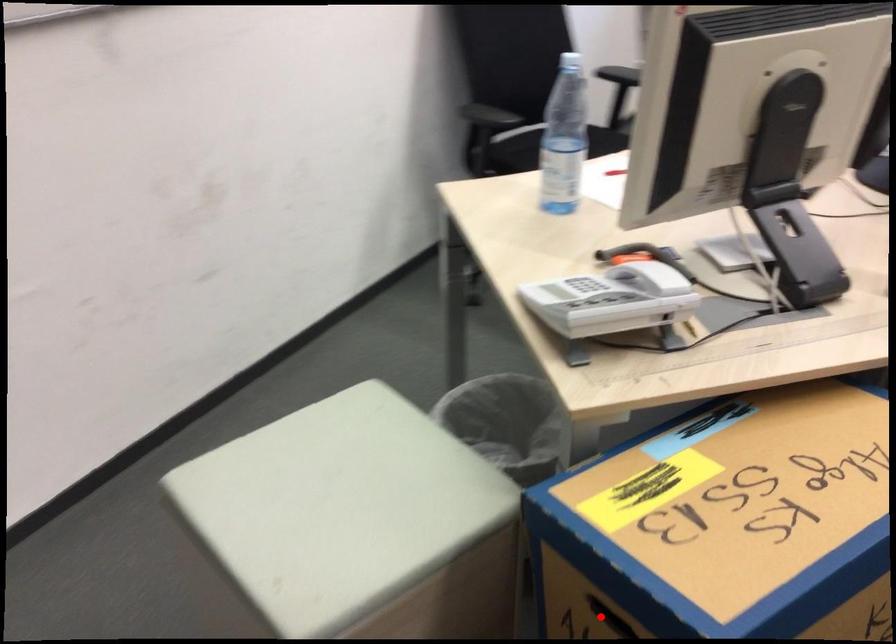
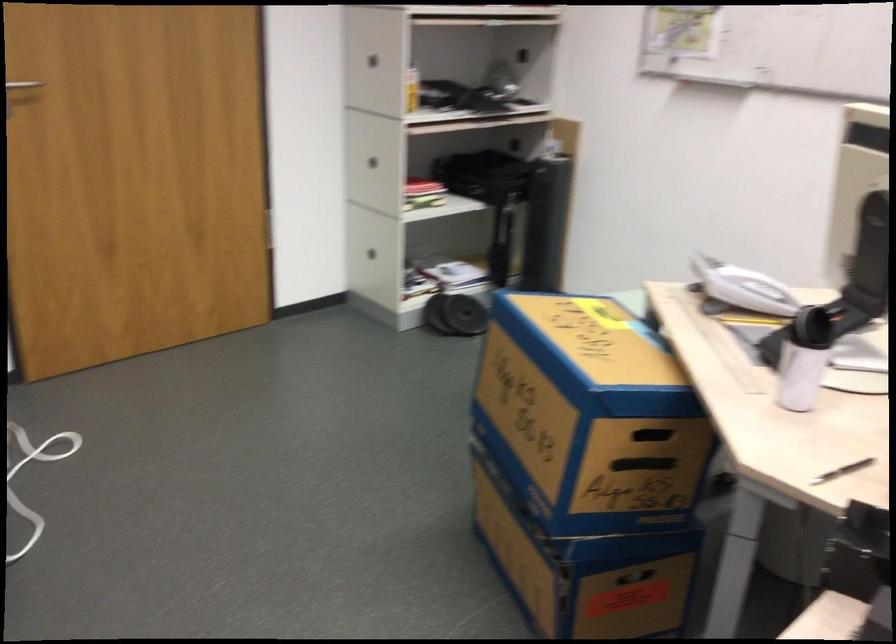
Question: I am providing you with two images of the same scene from different viewpoints. A red point is marked on the first image. Is the red point's position out of view in image 2?

Choices:
 (A) Yes
 (B) No

Answer: (A)